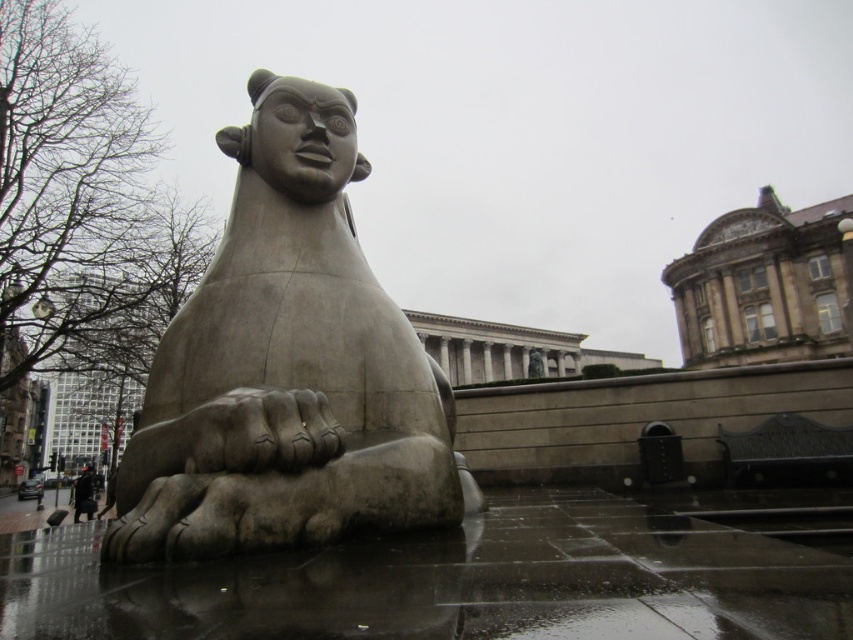
You are an artist planning to create a miniature version of the gray stone sculpture at center and the dark brown leather coat at lower left. If you want the miniature versions to maintain the same size relationship as in the original image, which object should you make smaller?

The gray stone sculpture at center should be made smaller because its width in the original image is less than the dark brown leather coat at lower left.

You are standing in the public square and want to take a photo of the gray stone sculpture at center. If you are using a camera with a 50mm lens, which is set to a focal length that captures a field of view corresponding to a rectangle from point A at the bottom left corner at coordinates approximately 0.0 to 0.0 to point B at the top right corner at approximately 1.0 to 1.0 in normalized coordinates. Where should you position yourself relative to the square to ensure the entire sculpture is within the view

The gray stone sculpture at center is located at point (x=288, y=369) in normalized coordinates, which is within the field of view of the camera set from point A at (x=0, y=0) to point B at (x=852, y=639). Therefore, you can position yourself anywhere within the square as long as the sculpture is framed within the camera view. Since the sculpture is centrally located, standing at a central position facing it should ensure it stays within the frame.